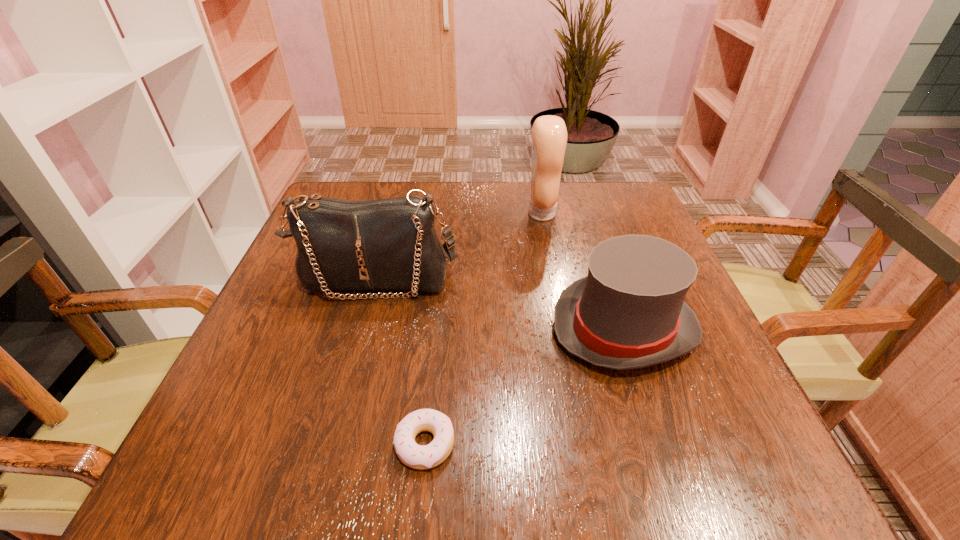
Identify the location of free space that satisfies the following two spatial constraints: 1. on the label of the farthest object; 2. on the back side of the third tallest object. The width and height of the screenshot is (960, 540). (563, 328).

Locate an element on the screen. The width and height of the screenshot is (960, 540). vacant space that satisfies the following two spatial constraints: 1. on the back side of the shortest object; 2. on the right side of the dress hat is located at coordinates (437, 328).

Where is `free spot that satisfies the following two spatial constraints: 1. on the label of the condiment; 2. on the back side of the dress hat`? The height and width of the screenshot is (540, 960). free spot that satisfies the following two spatial constraints: 1. on the label of the condiment; 2. on the back side of the dress hat is located at coordinates (563, 328).

Where is `vacant space that satisfies the following two spatial constraints: 1. at the front of the handbag with chain and zipper; 2. on the left side of the doughnut`? The image size is (960, 540). vacant space that satisfies the following two spatial constraints: 1. at the front of the handbag with chain and zipper; 2. on the left side of the doughnut is located at coordinates (332, 444).